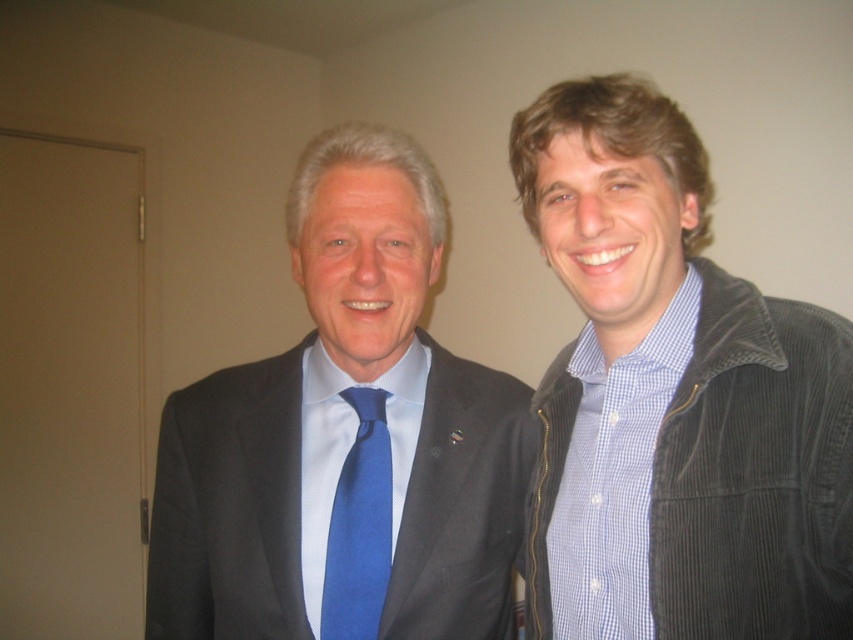
You are designing a new coat rack and need to know the relative widths of the corduroy jacket at right and the matte black suit at left. Which one is wider?

The matte black suit at left is wider than the corduroy jacket at right.

You are a photographer setting up for a portrait. You need to ensure that the matte black suit at left and the blue silk tie at center are both visible in the frame. Based on their positions, which object is covering part of the other?

The matte black suit at left is positioned over the blue silk tie at center, so it is covering part of the blue silk tie at center.

You are a photographer adjusting your camera settings to focus on the corduroy jacket at right and the blue silk tie at center. Which object should you focus on first to ensure both are in sharp focus?

The corduroy jacket at right is closer to the viewer than the blue silk tie at center, so you should focus on the corduroy jacket at right first to ensure both are in sharp focus.